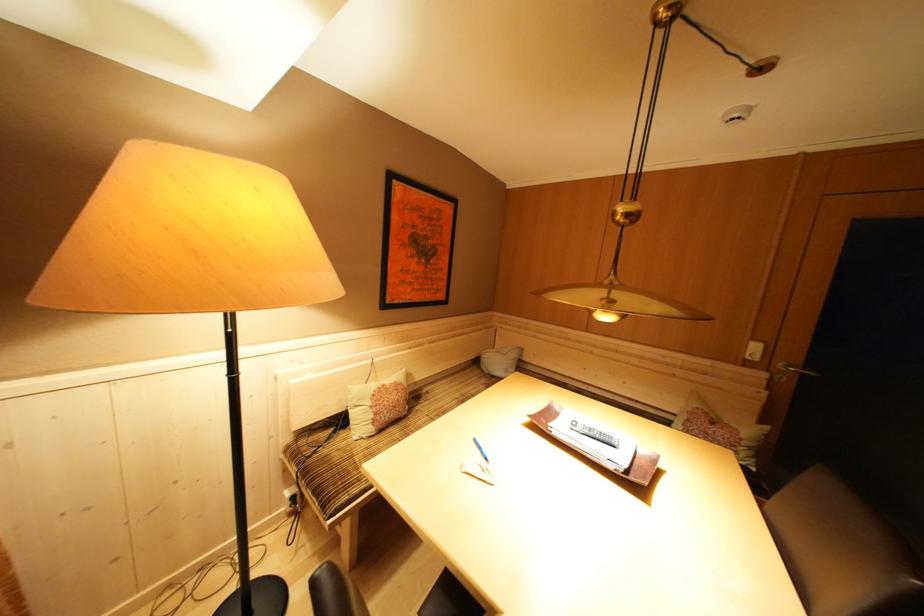
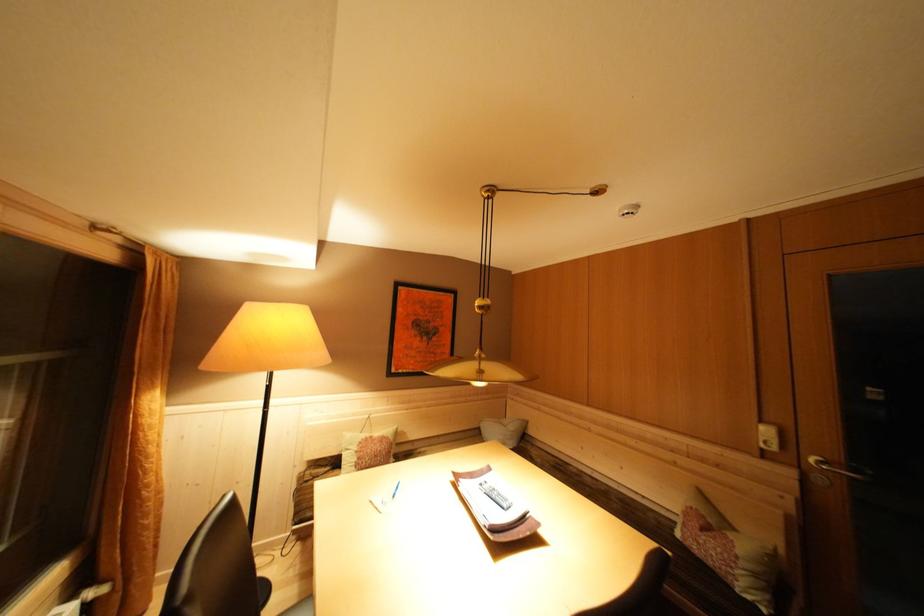
In the second image, find the point that corresponds to [749,440] in the first image.

(746, 557)